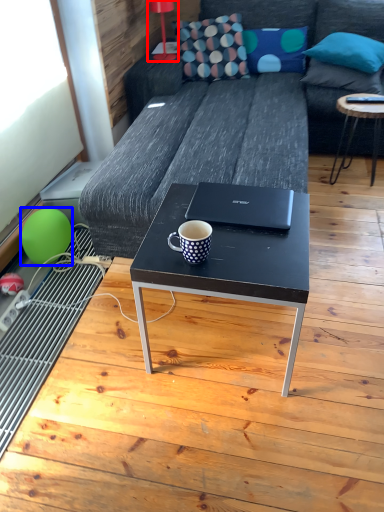
Question: Which of the following is the closest to the observer, lamp (highlighted by a red box) or balloon (highlighted by a blue box)?

Choices:
 (A) lamp
 (B) balloon

Answer: (B)